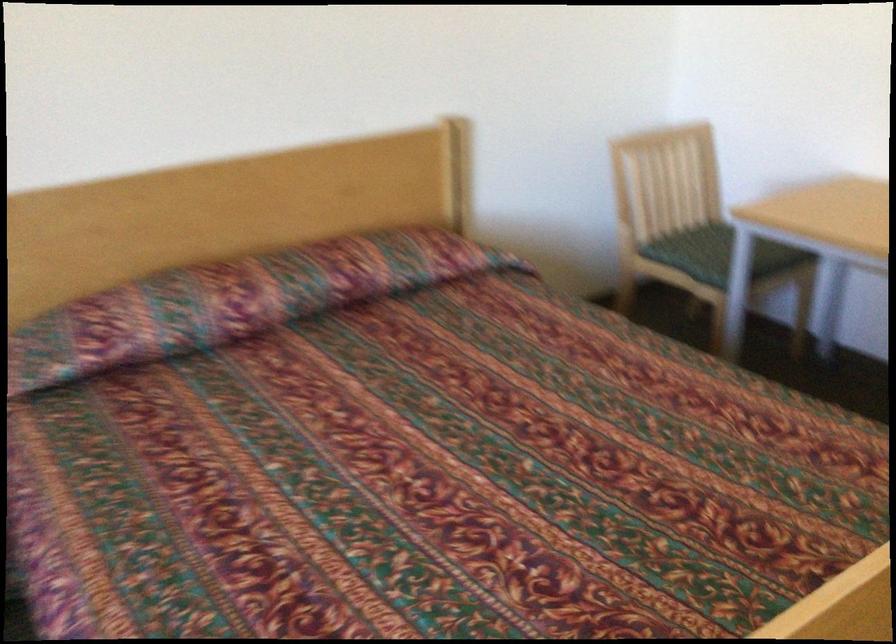
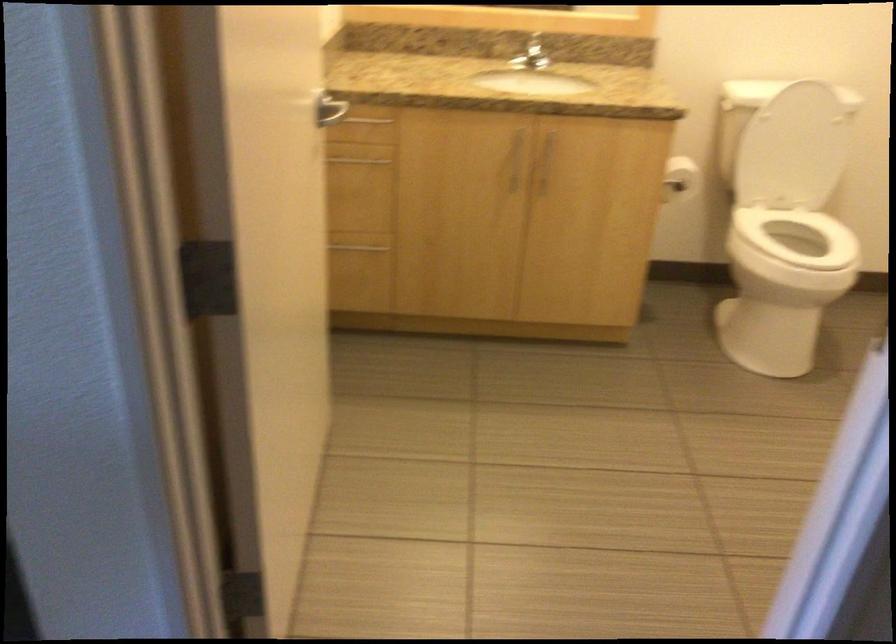
Question: What movement of the cameraman would produce the second image?

Choices:
 (A) Left
 (B) Right
 (C) Forward
 (D) Backward

Answer: (B)